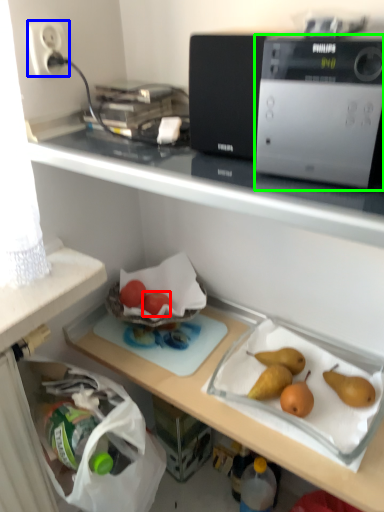
Question: Which object is the closest to the fruit (highlighted by a red box)? Choose among these: electric outlet (highlighted by a blue box) or home appliance (highlighted by a green box).

Choices:
 (A) electric outlet
 (B) home appliance

Answer: (A)